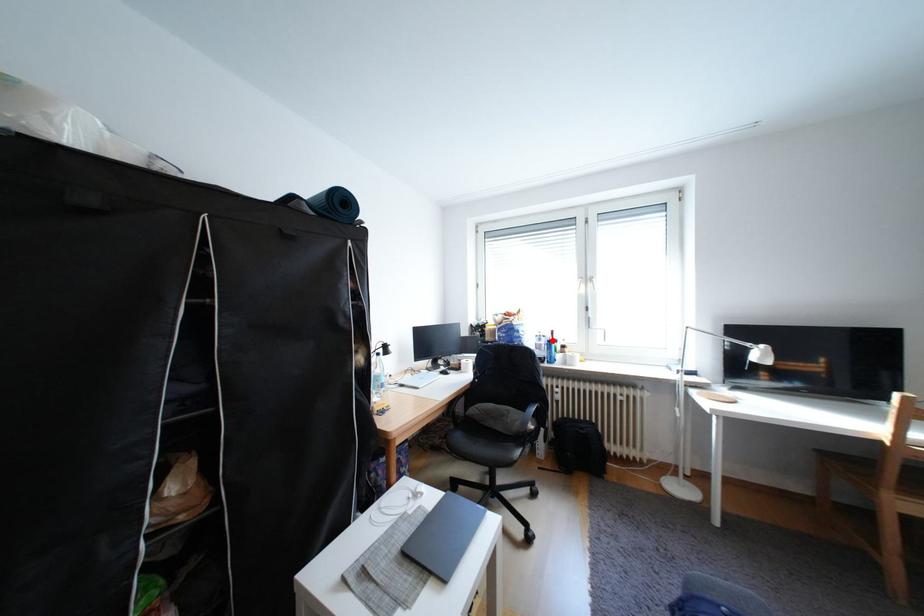
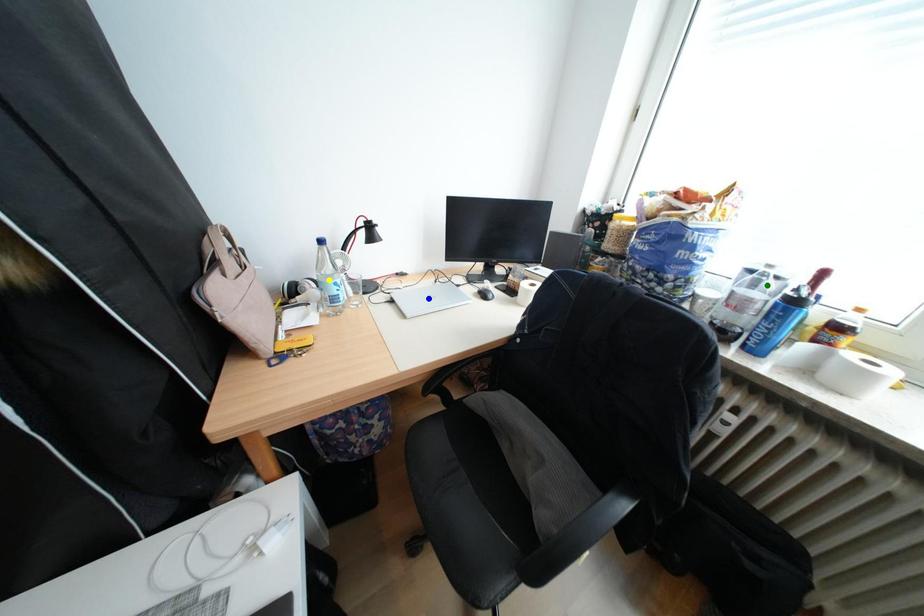
Question: I am providing you with two images of the same scene from different viewpoints. A red point is marked on the first image. You are given multiple points on the second image. In image 2, which mark is for the same physical point as the one in image 1?

Choices:
 (A) green point
 (B) yellow point
 (C) blue point

Answer: (A)